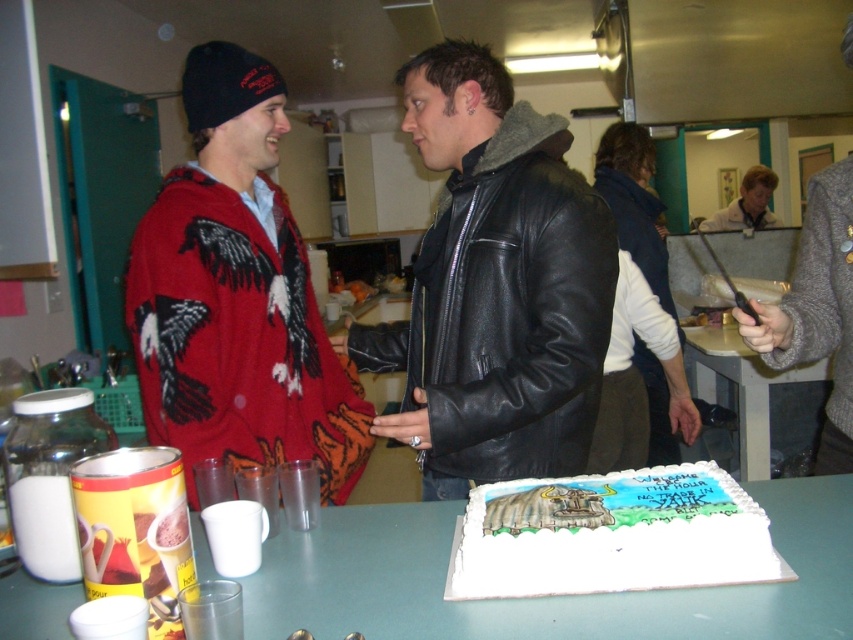
You are at the coordinates 0.5,0.5 in the image. You want to walk directly to the white fondant cake at center. Which direction should you move?

Since the white fondant cake at center is located at coordinates (608, 534), you should move northeast to reach it from your current position at (426, 320).

You are at the party and want to take a photo of the white fleece vest at center and the green plastic table at center. Which object should you focus on first if you want to capture both in the same frame without moving the camera?

You should focus on the white fleece vest at center first because it is closer to you than the green plastic table at center, allowing both to be in the same frame without moving the camera.

In the scene shown: You are at a party and want to take a photo with both the white fondant cake at center and the white fleece vest at center in the frame. Based on their positions and sizes, do you think you can fit both into a single photo without moving either object?

The white fondant cake at center might be wider than the white fleece vest at center, so there is a possibility that the cake could block part of the vest in the photo if they are positioned close together. To ensure both are visible, you may need to adjust your angle or move slightly to include both in the frame.